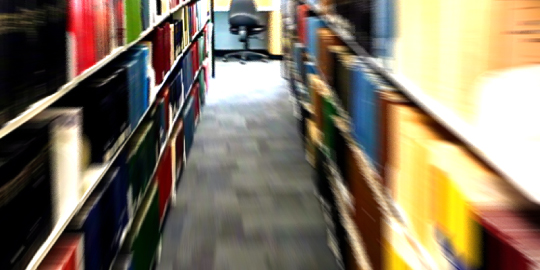
At what (x,y) coordinates should I click in order to perform the action: click on floor. Please return your answer as a coordinate pair (x, y). Looking at the image, I should click on (260, 221).